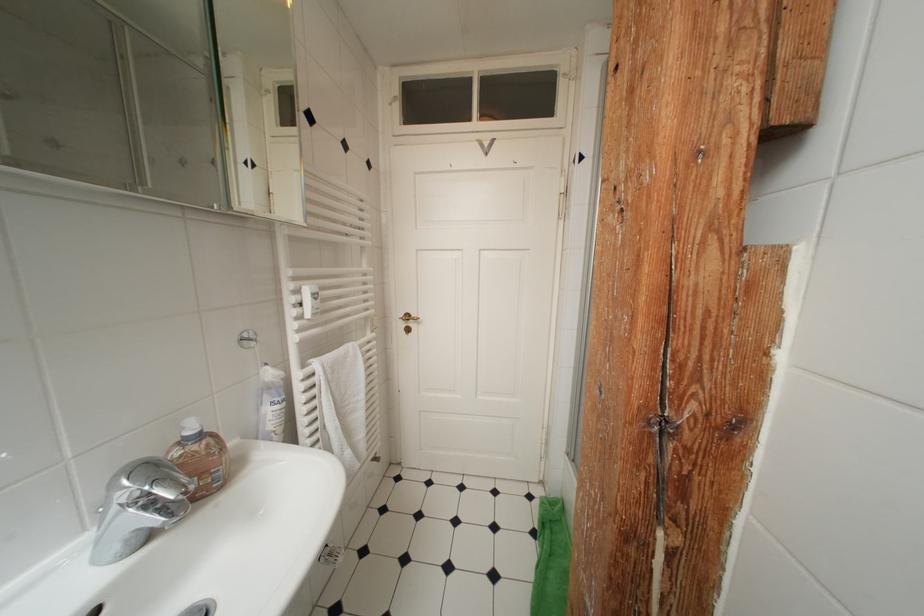
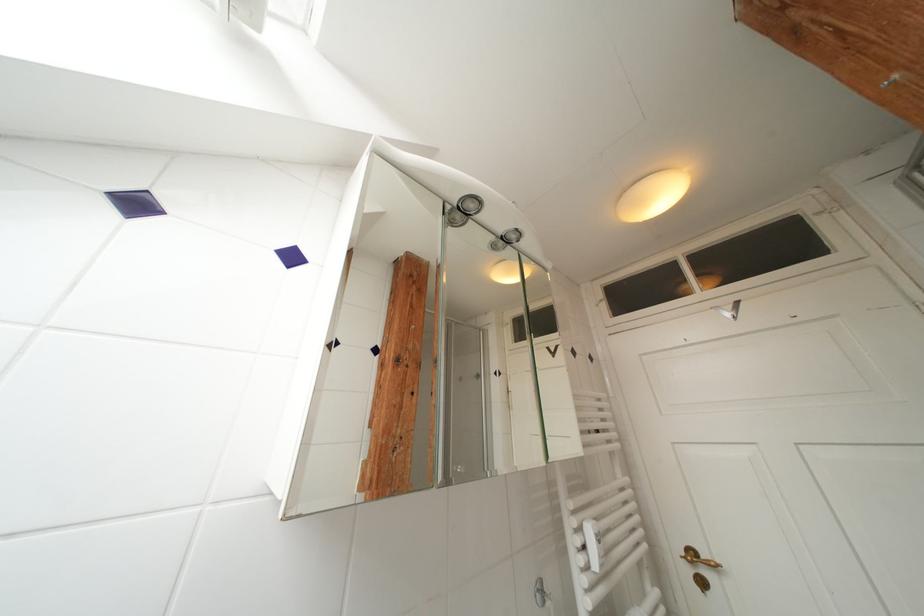
The point at (304, 294) is marked in the first image. Where is the corresponding point in the second image?

(586, 533)